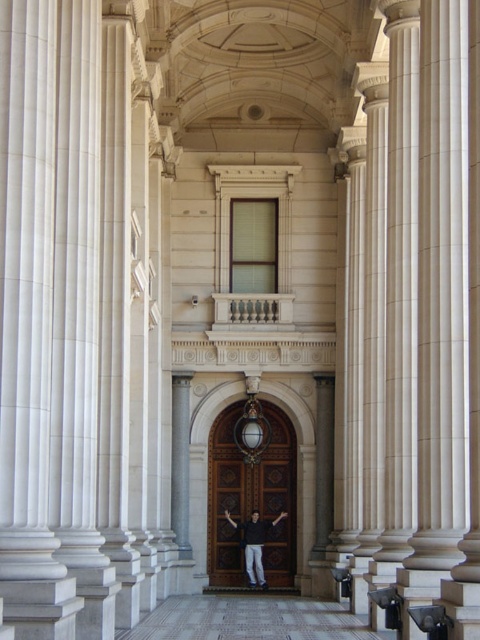
This screenshot has height=640, width=480. Describe the element at coordinates (251, 497) in the screenshot. I see `polished wood door at center` at that location.

Who is positioned more to the right, polished wood door at center or dark gray shirt at center?

dark gray shirt at center

Which is in front, point (220, 472) or point (249, 560)?

Point (249, 560) is more forward.

Where is `polished wood door at center`? This screenshot has width=480, height=640. polished wood door at center is located at coordinates (251, 497).